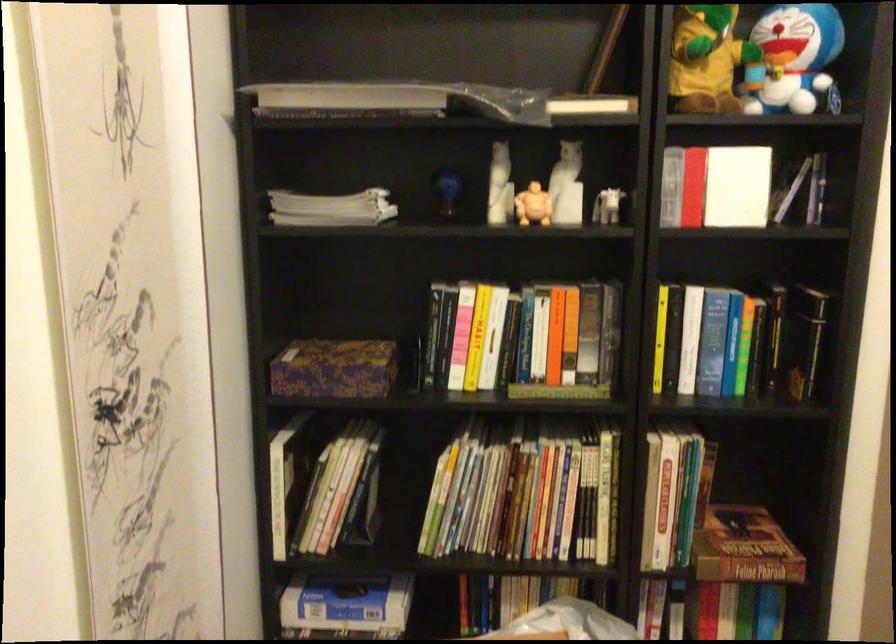
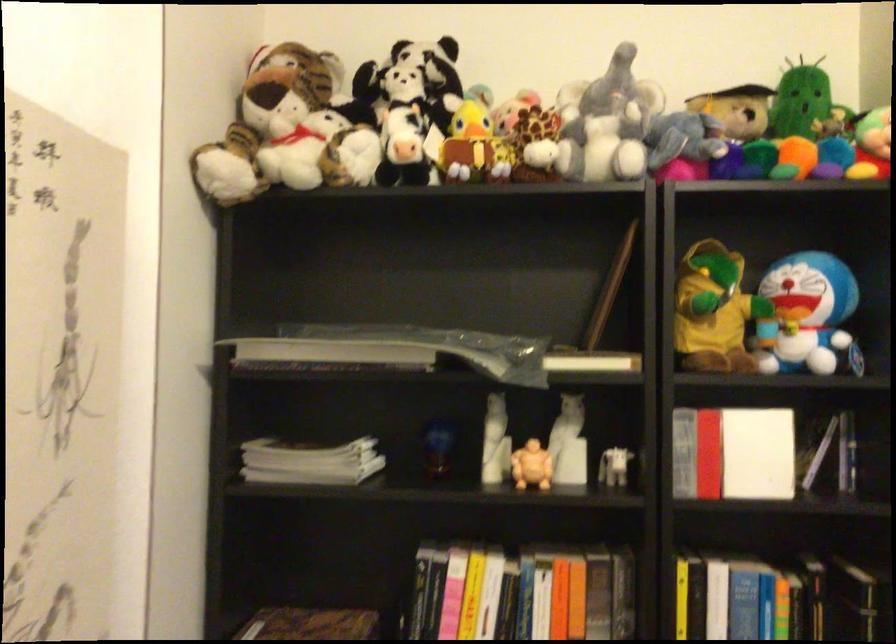
The images are taken continuously from a first-person perspective. In which direction are you moving?

The cameraman walked toward right, forward.